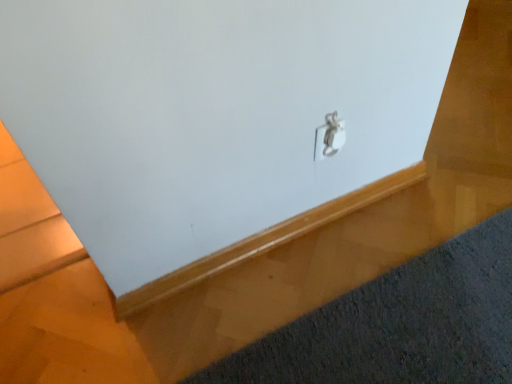
Question: Does silver metallic lock at center lie in front of dark gray carpet at lower right?

Choices:
 (A) no
 (B) yes

Answer: (A)

Question: From the image's perspective, is silver metallic lock at center under dark gray carpet at lower right?

Choices:
 (A) no
 (B) yes

Answer: (A)

Question: From a real-world perspective, is silver metallic lock at center physically below dark gray carpet at lower right?

Choices:
 (A) no
 (B) yes

Answer: (A)

Question: Is silver metallic lock at center at the left side of dark gray carpet at lower right?

Choices:
 (A) yes
 (B) no

Answer: (A)

Question: From a real-world perspective, is silver metallic lock at center physically above dark gray carpet at lower right?

Choices:
 (A) no
 (B) yes

Answer: (B)

Question: Considering the relative sizes of silver metallic lock at center and dark gray carpet at lower right in the image provided, is silver metallic lock at center bigger than dark gray carpet at lower right?

Choices:
 (A) yes
 (B) no

Answer: (B)

Question: From a real-world perspective, is dark gray carpet at lower right positioned over silver metallic lock at center based on gravity?

Choices:
 (A) yes
 (B) no

Answer: (B)

Question: Does dark gray carpet at lower right come behind silver metallic lock at center?

Choices:
 (A) no
 (B) yes

Answer: (A)

Question: Is silver metallic lock at center at the back of dark gray carpet at lower right?

Choices:
 (A) no
 (B) yes

Answer: (A)

Question: Could you tell me if dark gray carpet at lower right is facing silver metallic lock at center?

Choices:
 (A) no
 (B) yes

Answer: (A)

Question: Are dark gray carpet at lower right and silver metallic lock at center making contact?

Choices:
 (A) no
 (B) yes

Answer: (A)

Question: Is dark gray carpet at lower right smaller than silver metallic lock at center?

Choices:
 (A) yes
 (B) no

Answer: (B)

Question: Looking at the image, does silver metallic lock at center seem bigger or smaller compared to dark gray carpet at lower right?

Choices:
 (A) big
 (B) small

Answer: (B)